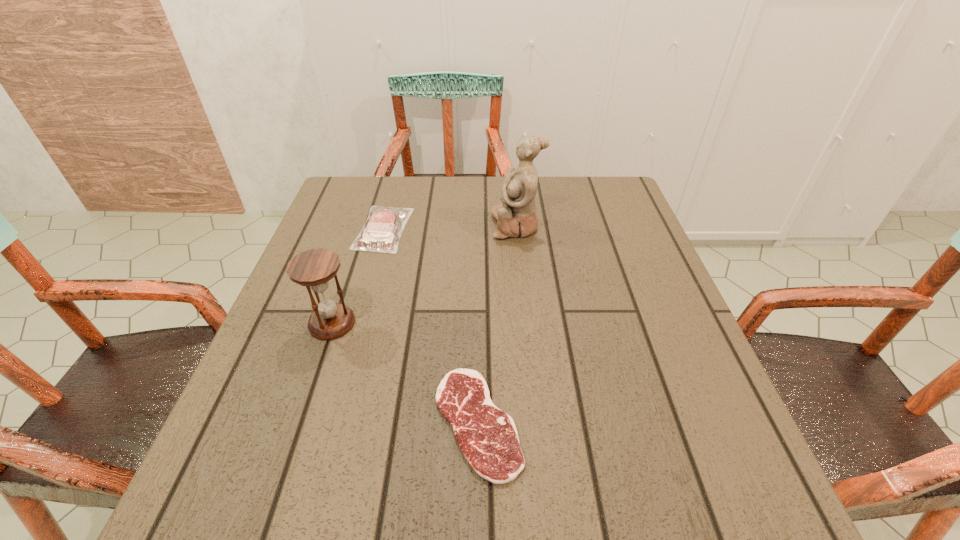
Where is `free space between the second nearest object and the second shortest object`? Image resolution: width=960 pixels, height=540 pixels. free space between the second nearest object and the second shortest object is located at coordinates (358, 276).

The width and height of the screenshot is (960, 540). I want to click on empty location between the second nearest object and the shortest object, so click(405, 373).

Find the location of a particular element. This screenshot has height=540, width=960. free spot between the second shortest object and the tallest object is located at coordinates (450, 227).

Identify the location of vacant area that lies between the farther steak and the figurine. (450, 227).

Image resolution: width=960 pixels, height=540 pixels. In order to click on free space between the second tallest object and the tallest object in this screenshot , I will do `click(424, 274)`.

Identify which object is located as the third nearest to the third shortest object. Please provide its 2D coordinates. Your answer should be formatted as a tuple, i.e. [(x, y)], where the tuple contains the x and y coordinates of a point satisfying the conditions above.

[(516, 216)]

Select which object appears as the third closest to the hourglass. Please provide its 2D coordinates. Your answer should be formatted as a tuple, i.e. [(x, y)], where the tuple contains the x and y coordinates of a point satisfying the conditions above.

[(516, 216)]

Find the location of a particular element. The height and width of the screenshot is (540, 960). free space that satisfies the following two spatial constraints: 1. on the front-facing side of the figurine; 2. on the front side of the third shortest object is located at coordinates (526, 323).

Where is `blank space that satisfies the following two spatial constraints: 1. on the front-facing side of the tallest object; 2. on the front side of the second tallest object`? The width and height of the screenshot is (960, 540). blank space that satisfies the following two spatial constraints: 1. on the front-facing side of the tallest object; 2. on the front side of the second tallest object is located at coordinates (526, 323).